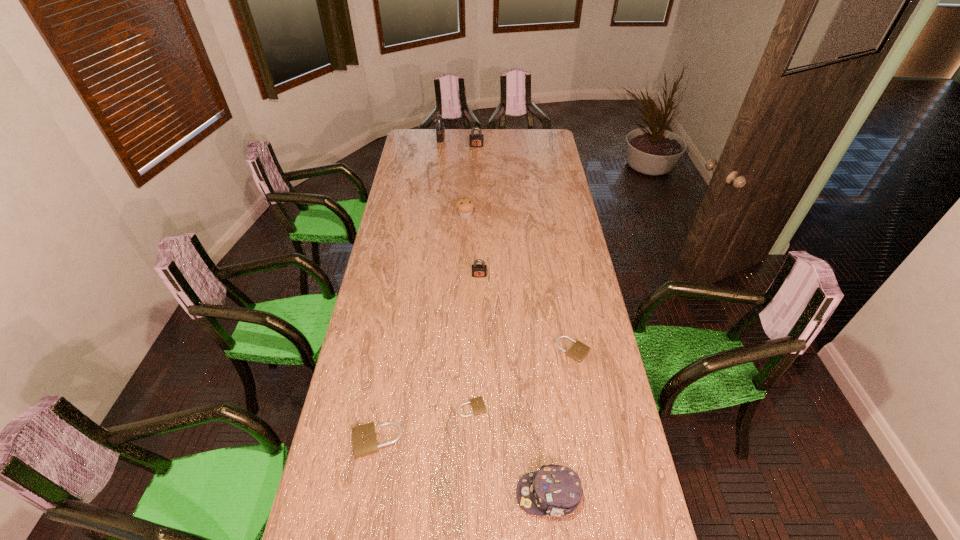
Locate an element on the screen. the second shortest object is located at coordinates (579, 350).

This screenshot has height=540, width=960. What are the coordinates of `the third nearest padlock` in the screenshot? It's located at (579, 350).

Locate an element on the screen. the third nearest object is located at coordinates (477, 404).

Locate an element on the screen. The width and height of the screenshot is (960, 540). the smallest beige padlock is located at coordinates (477, 404).

Where is `free point located on the front of the leftmost gray padlock near the keyhole`? free point located on the front of the leftmost gray padlock near the keyhole is located at coordinates tap(479, 138).

This screenshot has height=540, width=960. I want to click on vacant region located 0.300m on the front of the seventh shortest object near the keyhole, so pos(476,175).

Find the location of a particular element. This screenshot has height=540, width=960. free spot located 0.140m on the front of the smallest gray padlock near the keyhole is located at coordinates 479,302.

The height and width of the screenshot is (540, 960). I want to click on vacant space situated on the front of the sixth nearest object, so click(x=465, y=242).

Locate an element on the screen. This screenshot has width=960, height=540. vacant space located 0.260m on the front-facing side of the headwear is located at coordinates (425, 495).

At what (x,y) coordinates should I click in order to perform the action: click on vacant space situated on the front-facing side of the headwear. Please return your answer as a coordinate pair (x, y). The height and width of the screenshot is (540, 960). Looking at the image, I should click on (492, 495).